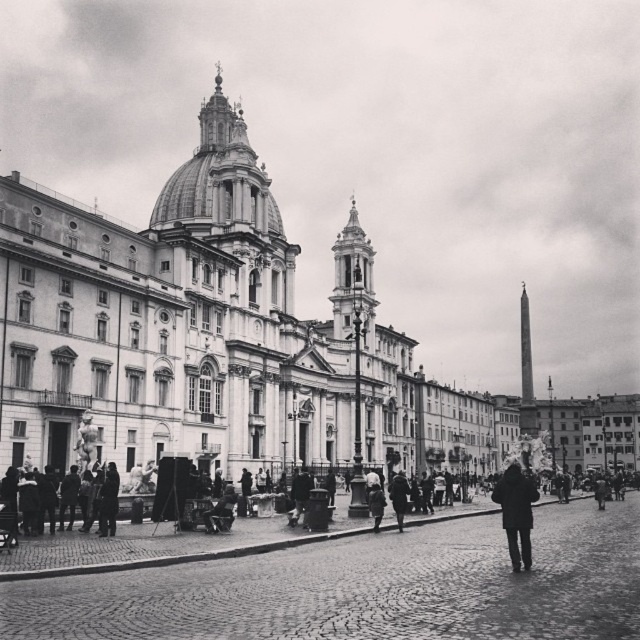
Question: Estimate the real-world distances between objects in this image. Which object is farther from the dark gray coat at center?

Choices:
 (A) smooth cobblestone street at center
 (B) white marble palace at center
 (C) dark gray coat at lower right

Answer: (B)

Question: Which object appears closest to the camera in this image?

Choices:
 (A) white marble palace at center
 (B) dark gray coat at center
 (C) dark gray coat at lower right

Answer: (A)

Question: Is dark wool coat at lower right further to the viewer compared to dark gray coat at lower right?

Choices:
 (A) yes
 (B) no

Answer: (B)

Question: Which of these objects is positioned closest to the white marble palace at center?

Choices:
 (A) dark gray coat at lower right
 (B) dark wool coat at lower right
 (C) smooth cobblestone street at center

Answer: (A)

Question: Is white marble palace at center positioned in front of dark gray coat at center?

Choices:
 (A) yes
 (B) no

Answer: (A)

Question: Does smooth cobblestone street at center come in front of dark gray coat at lower right?

Choices:
 (A) yes
 (B) no

Answer: (A)